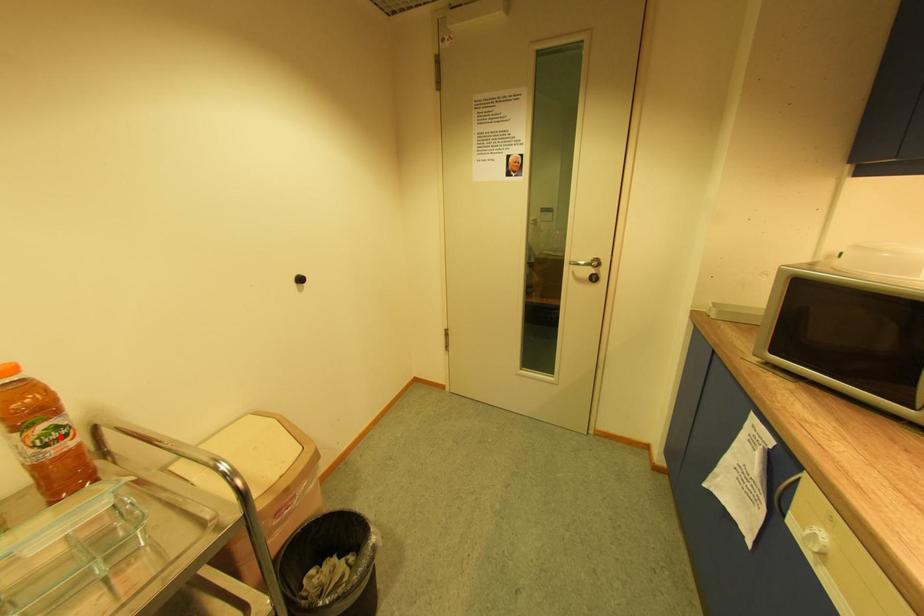
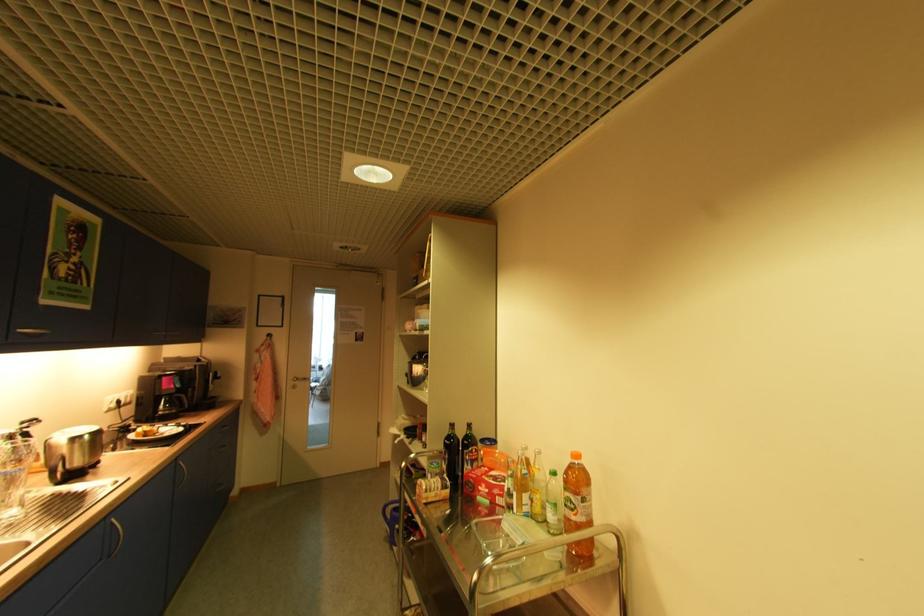
Find the pixel in the second image that matches the highlighted location in the first image.

(575, 506)